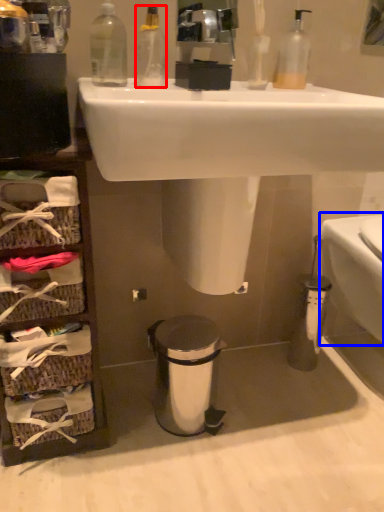
Question: Which point is further to the camera, cleaning product (highlighted by a red box) or toilet bowl (highlighted by a blue box)?

Choices:
 (A) cleaning product
 (B) toilet bowl

Answer: (B)